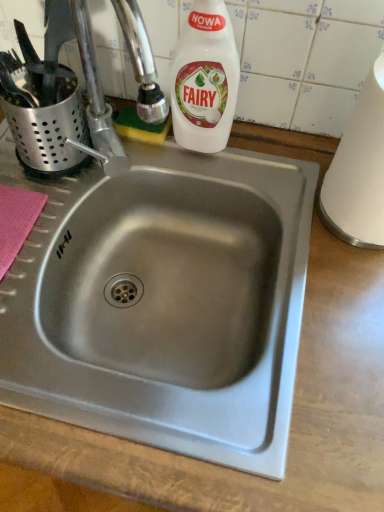
You are a GUI agent. You are given a task and a screenshot of the screen. Output one action in this format:
    pyautogui.click(x=<x>, y=<y>)
    Task: Click on the free space in front of white matte paper towel at right
    
    Given the screenshot: What is the action you would take?
    pyautogui.click(x=329, y=297)